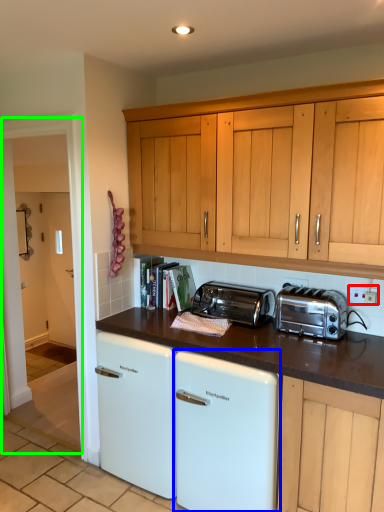
Question: Estimate the real-world distances between objects in this image. Which object is closer to electric outlet (highlighted by a red box), home appliance (highlighted by a blue box) or glass door (highlighted by a green box)?

Choices:
 (A) home appliance
 (B) glass door

Answer: (A)